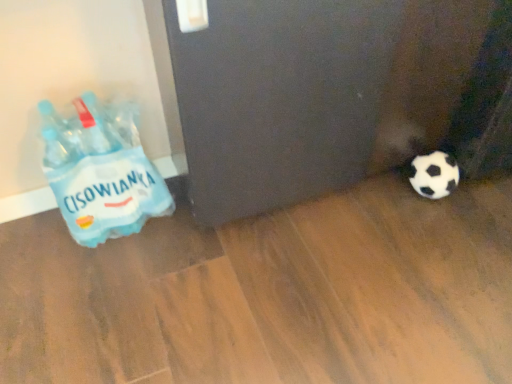
What do you see at coordinates (101, 170) in the screenshot?
I see `blue plastic bottle at left` at bounding box center [101, 170].

This screenshot has height=384, width=512. I want to click on blue plastic bottle at left, so click(101, 170).

In order to face black matte screen door at lower right, should I rotate leftwards or rightwards?

To align with it, rotate right about 8.131°.

What do you see at coordinates (278, 98) in the screenshot?
I see `black matte screen door at lower right` at bounding box center [278, 98].

Measure the distance between point (355, 127) and camera.

The depth of point (355, 127) is 38.19 inches.

The image size is (512, 384). I want to click on black matte screen door at lower right, so click(x=278, y=98).

Where is `blue plastic bottle at left`? This screenshot has width=512, height=384. blue plastic bottle at left is located at coordinates (101, 170).

Is black matte screen door at lower right to the left or to the right of blue plastic bottle at left in the image?

Based on their positions, black matte screen door at lower right is located to the right of blue plastic bottle at left.

Is black matte screen door at lower right further to the viewer compared to blue plastic bottle at left?

No, black matte screen door at lower right is closer to the viewer.

Is point (340, 102) positioned before point (127, 176)?

Yes, it is in front of point (127, 176).

From the image's perspective, is black matte screen door at lower right positioned above or below blue plastic bottle at left?

Based on their image positions, black matte screen door at lower right is located above blue plastic bottle at left.

From a real-world perspective, which is physically above, black matte screen door at lower right or blue plastic bottle at left?

black matte screen door at lower right, from a real-world perspective.

Considering the relative sizes of black matte screen door at lower right and blue plastic bottle at left in the image provided, is black matte screen door at lower right wider than blue plastic bottle at left?

Yes, black matte screen door at lower right is wider than blue plastic bottle at left.

Can you confirm if black matte screen door at lower right is taller than blue plastic bottle at left?

Indeed, black matte screen door at lower right has a greater height compared to blue plastic bottle at left.

Based on the photo, considering the relative sizes of black matte screen door at lower right and blue plastic bottle at left in the image provided, is black matte screen door at lower right smaller than blue plastic bottle at left?

Actually, black matte screen door at lower right might be larger than blue plastic bottle at left.

Can we say black matte screen door at lower right lies outside blue plastic bottle at left?

Indeed, black matte screen door at lower right is completely outside blue plastic bottle at left.

Is black matte screen door at lower right placed right next to blue plastic bottle at left?

No, black matte screen door at lower right is not in contact with blue plastic bottle at left.

Could you tell me if black matte screen door at lower right is facing blue plastic bottle at left?

No, black matte screen door at lower right is not oriented towards blue plastic bottle at left.

Image resolution: width=512 pixels, height=384 pixels. Find the location of `bottle located behind the black matte screen door at lower right`. bottle located behind the black matte screen door at lower right is located at coordinates (101, 170).

Is blue plastic bottle at left to the left of black matte screen door at lower right from the viewer's perspective?

Correct, you'll find blue plastic bottle at left to the left of black matte screen door at lower right.

Is blue plastic bottle at left in front of or behind black matte screen door at lower right in the image?

Clearly, blue plastic bottle at left is behind black matte screen door at lower right.

Is point (80, 149) positioned before point (335, 34)?

No, it is behind (335, 34).

From the image's perspective, is blue plastic bottle at left above or below black matte screen door at lower right?

blue plastic bottle at left is situated lower than black matte screen door at lower right in the image.

From a real-world perspective, relative to black matte screen door at lower right, is blue plastic bottle at left vertically above or below?

blue plastic bottle at left is below black matte screen door at lower right.

Based on the photo, between blue plastic bottle at left and black matte screen door at lower right, which one has smaller width?

Thinner between the two is blue plastic bottle at left.

Considering the relative sizes of blue plastic bottle at left and black matte screen door at lower right in the image provided, is blue plastic bottle at left taller than black matte screen door at lower right?

No.

Can you confirm if blue plastic bottle at left is bigger than black matte screen door at lower right?

Incorrect, blue plastic bottle at left is not larger than black matte screen door at lower right.

Could black matte screen door at lower right be considered to be inside blue plastic bottle at left?

Actually, black matte screen door at lower right is outside blue plastic bottle at left.

Is blue plastic bottle at left beside black matte screen door at lower right?

No, blue plastic bottle at left is not with black matte screen door at lower right.

Could you tell me if blue plastic bottle at left is turned towards black matte screen door at lower right?

No, blue plastic bottle at left is not facing towards black matte screen door at lower right.

Can you tell me how much blue plastic bottle at left and black matte screen door at lower right differ in facing direction?

They differ by 0.167 degrees in their facing directions.

How much distance is there between blue plastic bottle at left and black matte screen door at lower right?

blue plastic bottle at left is 28.83 centimeters away from black matte screen door at lower right.

Identify the location of screen door lying above the blue plastic bottle at left (from the image's perspective). The image size is (512, 384). (278, 98).

Where is `screen door in front of the blue plastic bottle at left`? screen door in front of the blue plastic bottle at left is located at coordinates (278, 98).

In the image, there is a blue plastic bottle at left. Identify the location of screen door above it (from the image's perspective). (278, 98).